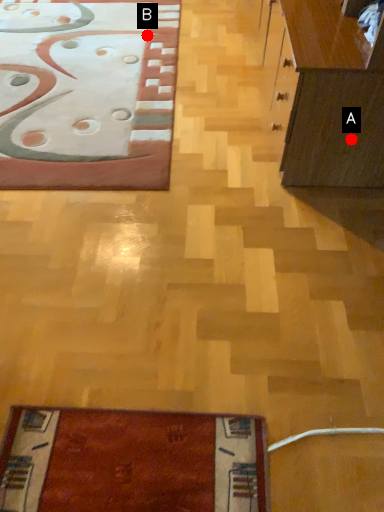
Question: Two points are circled on the image, labeled by A and B beside each circle. Which point is closer to the camera?

Choices:
 (A) A is closer
 (B) B is closer

Answer: (A)